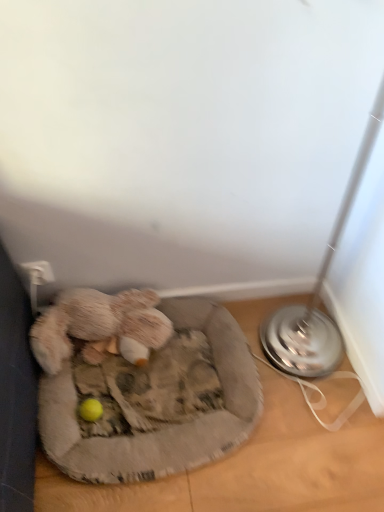
Measure the distance between fuzzy beige stuffed animal at lower left and camera.

fuzzy beige stuffed animal at lower left and camera are 4.41 feet apart from each other.

This screenshot has width=384, height=512. What do you see at coordinates (96, 323) in the screenshot? I see `fuzzy beige stuffed animal at lower left` at bounding box center [96, 323].

Find the location of `fuzzy beige stuffed animal at lower left`. fuzzy beige stuffed animal at lower left is located at coordinates (96, 323).

Locate an element on the screen. fluffy gray dog bed at lower left is located at coordinates (155, 402).

The image size is (384, 512). Describe the element at coordinates (155, 402) in the screenshot. I see `fluffy gray dog bed at lower left` at that location.

What are the coordinates of `fuzzy beige stuffed animal at lower left` in the screenshot? It's located at (96, 323).

Is fluffy gray dog bed at lower left at the right side of fuzzy beige stuffed animal at lower left?

Correct, you'll find fluffy gray dog bed at lower left to the right of fuzzy beige stuffed animal at lower left.

Considering their positions, is fluffy gray dog bed at lower left located in front of or behind fuzzy beige stuffed animal at lower left?

Clearly, fluffy gray dog bed at lower left is in front of fuzzy beige stuffed animal at lower left.

Does point (41, 437) come behind point (128, 314)?

That is False.

From the image's perspective, does fluffy gray dog bed at lower left appear lower than fuzzy beige stuffed animal at lower left?

Yes, from the image's perspective, fluffy gray dog bed at lower left is below fuzzy beige stuffed animal at lower left.

Consider the image. From a real-world perspective, relative to fuzzy beige stuffed animal at lower left, is fluffy gray dog bed at lower left vertically above or below?

fluffy gray dog bed at lower left is situated lower than fuzzy beige stuffed animal at lower left in the real world.

Looking at this image, considering the sizes of objects fluffy gray dog bed at lower left and fuzzy beige stuffed animal at lower left in the image provided, who is wider, fluffy gray dog bed at lower left or fuzzy beige stuffed animal at lower left?

Wider between the two is fluffy gray dog bed at lower left.

Based on the photo, who is taller, fluffy gray dog bed at lower left or fuzzy beige stuffed animal at lower left?

Standing taller between the two is fuzzy beige stuffed animal at lower left.

Can you confirm if fluffy gray dog bed at lower left is smaller than fuzzy beige stuffed animal at lower left?

No.

Would you say fluffy gray dog bed at lower left contains fuzzy beige stuffed animal at lower left?

No, fuzzy beige stuffed animal at lower left is not inside fluffy gray dog bed at lower left.

Is the surface of fluffy gray dog bed at lower left in direct contact with fuzzy beige stuffed animal at lower left?

fluffy gray dog bed at lower left is not next to fuzzy beige stuffed animal at lower left, and they're not touching.

Is fluffy gray dog bed at lower left oriented away from fuzzy beige stuffed animal at lower left?

Yes.

How many degrees apart are the facing directions of fluffy gray dog bed at lower left and fuzzy beige stuffed animal at lower left?

4.75e-05 degrees separate the facing orientations of fluffy gray dog bed at lower left and fuzzy beige stuffed animal at lower left.

In the image, there is a fuzzy beige stuffed animal at lower left. At what (x,y) coordinates should I click in order to perform the action: click on dog bed below it (from the image's perspective). Please return your answer as a coordinate pair (x, y). The width and height of the screenshot is (384, 512). Looking at the image, I should click on (155, 402).

Consider the image. Can you confirm if fuzzy beige stuffed animal at lower left is positioned to the left of fluffy gray dog bed at lower left?

Yes, fuzzy beige stuffed animal at lower left is to the left of fluffy gray dog bed at lower left.

Considering the positions of objects fuzzy beige stuffed animal at lower left and fluffy gray dog bed at lower left in the image provided, who is behind, fuzzy beige stuffed animal at lower left or fluffy gray dog bed at lower left?

fuzzy beige stuffed animal at lower left.

Which is less distant, [78,328] or [65,369]?

Point [78,328].

From the image's perspective, which is below, fuzzy beige stuffed animal at lower left or fluffy gray dog bed at lower left?

fluffy gray dog bed at lower left.

From a real-world perspective, which is physically below, fuzzy beige stuffed animal at lower left or fluffy gray dog bed at lower left?

fluffy gray dog bed at lower left, from a real-world perspective.

Is fuzzy beige stuffed animal at lower left wider than fluffy gray dog bed at lower left?

In fact, fuzzy beige stuffed animal at lower left might be narrower than fluffy gray dog bed at lower left.

Can you confirm if fuzzy beige stuffed animal at lower left is shorter than fluffy gray dog bed at lower left?

In fact, fuzzy beige stuffed animal at lower left may be taller than fluffy gray dog bed at lower left.

Can you confirm if fuzzy beige stuffed animal at lower left is bigger than fluffy gray dog bed at lower left?

No.

Would you say fuzzy beige stuffed animal at lower left is inside or outside fluffy gray dog bed at lower left?

fuzzy beige stuffed animal at lower left is not inside fluffy gray dog bed at lower left, it's outside.

Are fuzzy beige stuffed animal at lower left and fluffy gray dog bed at lower left far apart?

No, fuzzy beige stuffed animal at lower left is in close proximity to fluffy gray dog bed at lower left.

Is fuzzy beige stuffed animal at lower left facing away from fluffy gray dog bed at lower left?

fuzzy beige stuffed animal at lower left does not have its back to fluffy gray dog bed at lower left.

How distant is fuzzy beige stuffed animal at lower left from fluffy gray dog bed at lower left?

They are 6.61 inches apart.

The height and width of the screenshot is (512, 384). What are the coordinates of `dog bed that is on the right side of fuzzy beige stuffed animal at lower left` in the screenshot? It's located at (155, 402).

Find the location of a particular element. toy lying on the left of fluffy gray dog bed at lower left is located at coordinates (96, 323).

This screenshot has width=384, height=512. I want to click on toy above the fluffy gray dog bed at lower left (from the image's perspective), so click(96, 323).